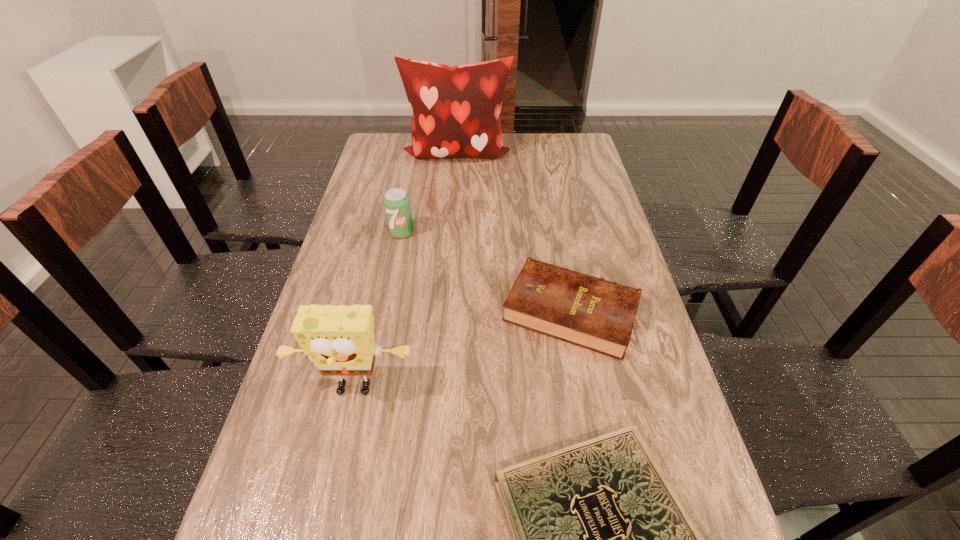
Identify the location of vacant space that satisfies the following two spatial constraints: 1. on the front-facing side of the cushion; 2. on the right side of the third nearest object. (444, 311).